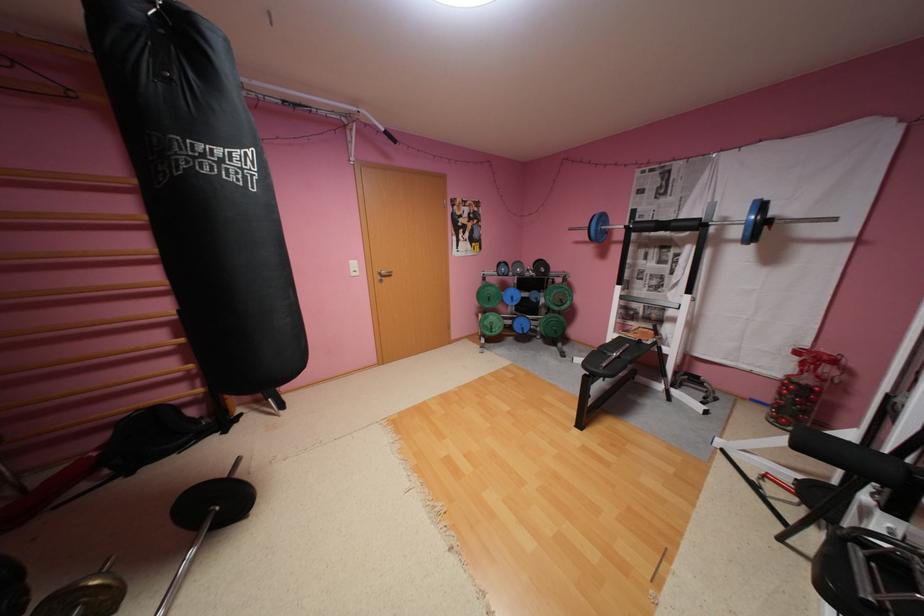
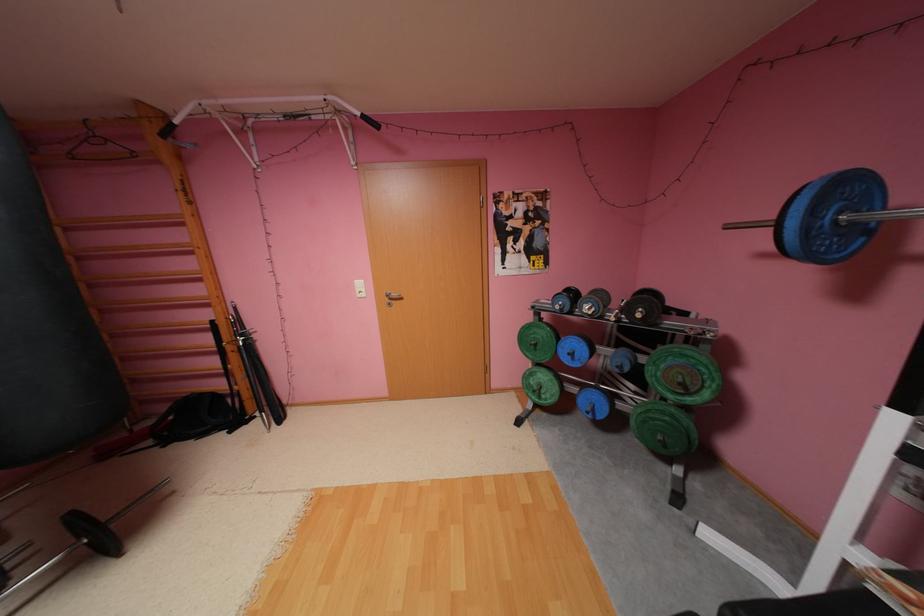
Locate, in the second image, the point that corresponds to pixel 529 331 in the first image.

(600, 416)